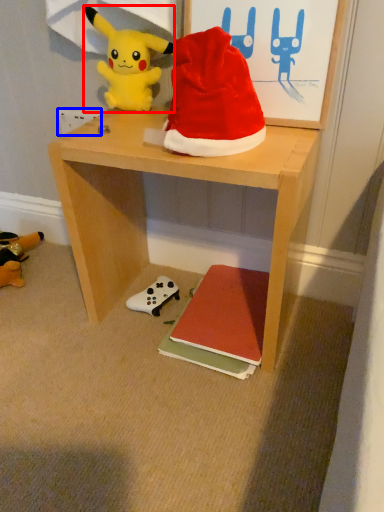
Question: Which object is further to the camera taking this photo, toy (highlighted by a red box) or power outlet (highlighted by a blue box)?

Choices:
 (A) toy
 (B) power outlet

Answer: (B)